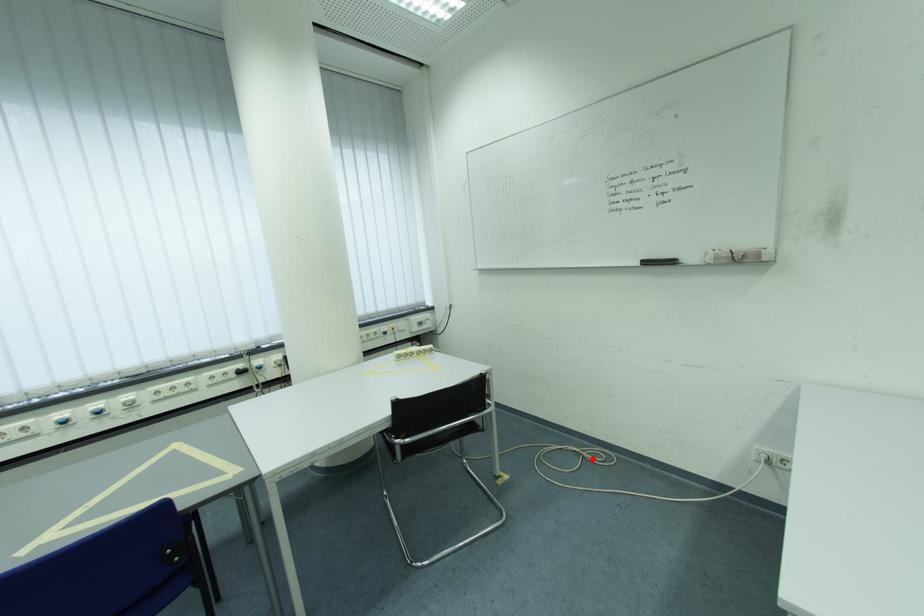
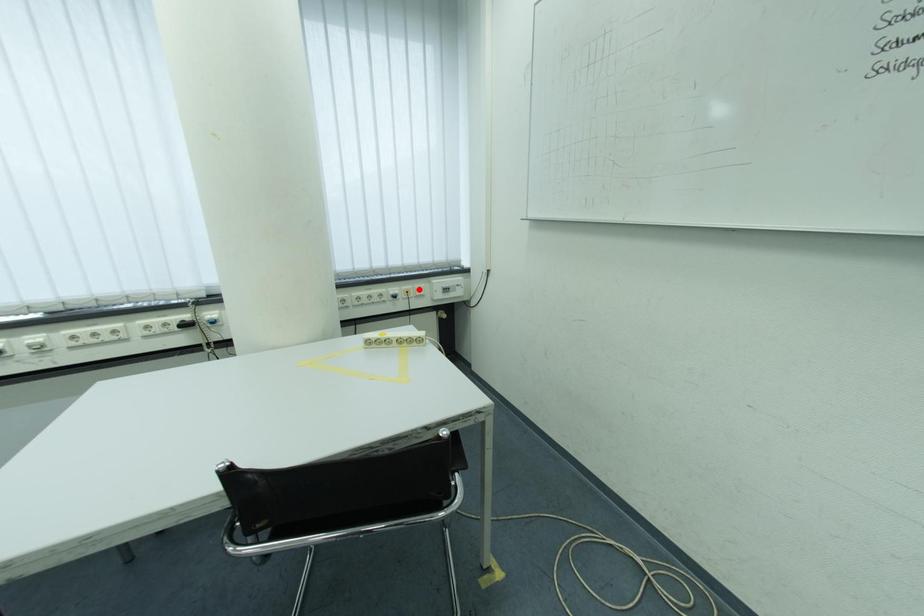
I am providing you with two images of the same scene from different viewpoints. A red point is marked on the first image and another point is marked on the second image. Are the points marked in image1 and image2 representing the same 3D position?

No